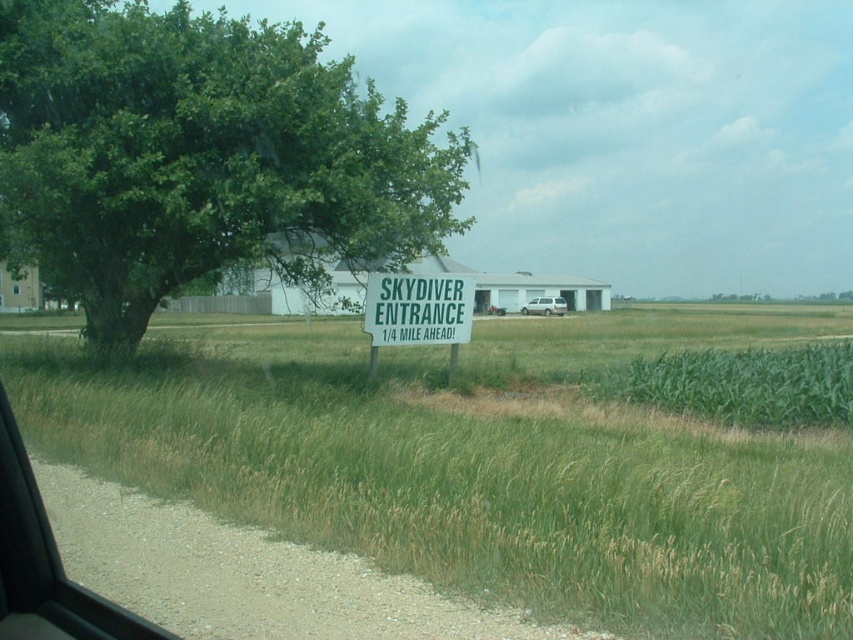
Is green grass at center shorter than silver metallic van at center?

Incorrect, green grass at center's height does not fall short of silver metallic van at center's.

Is green grass at center taller than silver metallic van at center?

Correct, green grass at center is much taller as silver metallic van at center.

Who is more forward, (651, 420) or (540, 305)?

Point (651, 420) is in front.

This screenshot has height=640, width=853. I want to click on green grass at center, so click(480, 460).

Consider the image. Is white plastic sign at center positioned in front of silver metallic van at center?

Yes.

Is white plastic sign at center positioned at the back of silver metallic van at center?

No.

Is point (381, 305) closer to viewer compared to point (535, 305)?

Yes.

This screenshot has width=853, height=640. I want to click on white plastic sign at center, so click(x=416, y=308).

Looking at this image, who is lower down, green grass at center or green leafy corn at right?

green leafy corn at right is below.

Can you confirm if green grass at center is positioned above green leafy corn at right?

Indeed, green grass at center is positioned over green leafy corn at right.

Is point (618, 621) more distant than point (761, 364)?

No, (618, 621) is closer to viewer.

Find the location of a particular element. green grass at center is located at coordinates (480, 460).